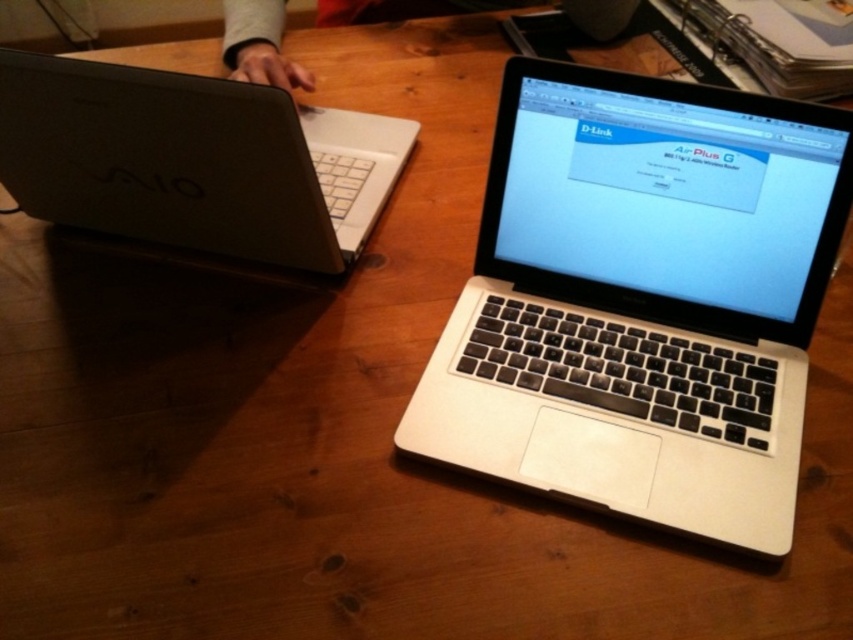
You are trying to decide which item to move first between the matte black laptop at left and the skinny jeans at upper center. Since you want to move the larger item first, which one should you choose?

The matte black laptop at left is larger in size than the skinny jeans at upper center, so you should move the matte black laptop at left first.

You are a photographer trying to capture a closeup shot of the Sony VAIO laptop. You have two points marked on the table where you can place your camera. The points are labeled as point (x=138, y=128) and point (x=270, y=68). Which point should you choose to get the closest view of the Sony VAIO laptop?

Point (x=138, y=128) is closer to the camera than point (x=270, y=68), so you should choose point (x=138, y=128) to get the closest view of the Sony VAIO laptop.